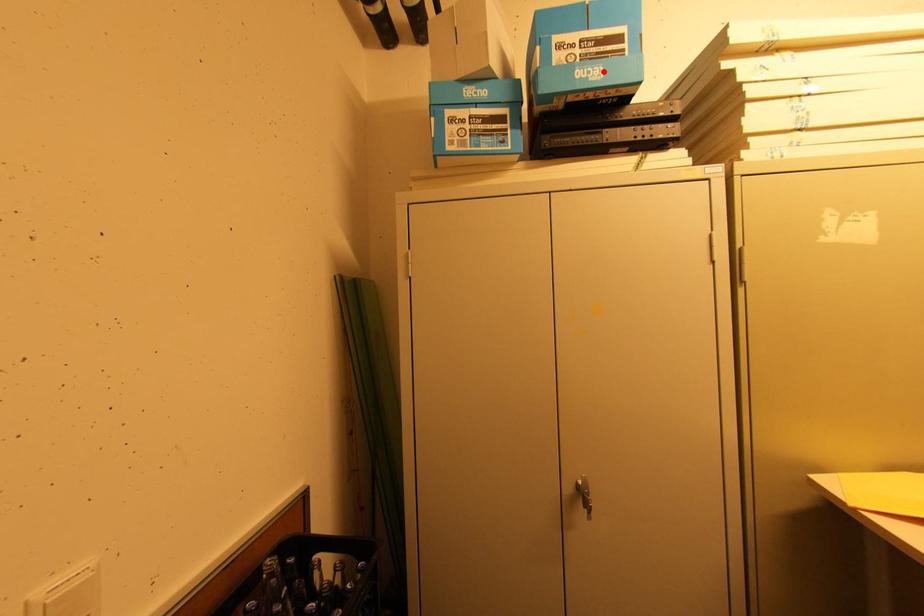
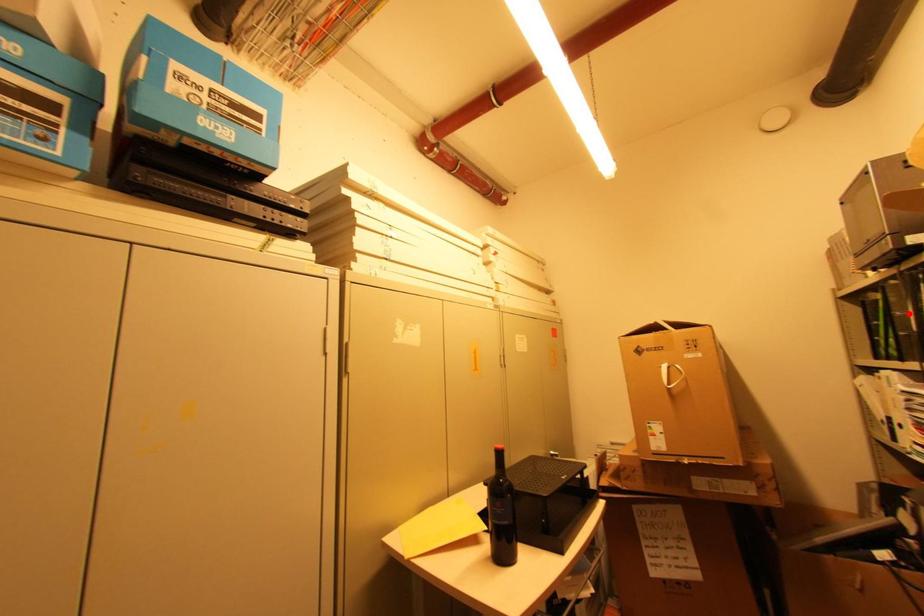
I am providing you with two images of the same scene from different viewpoints. A red point is marked on the first image and another point is marked on the second image. Do the highlighted points in image1 and image2 indicate the same real-world spot?

No